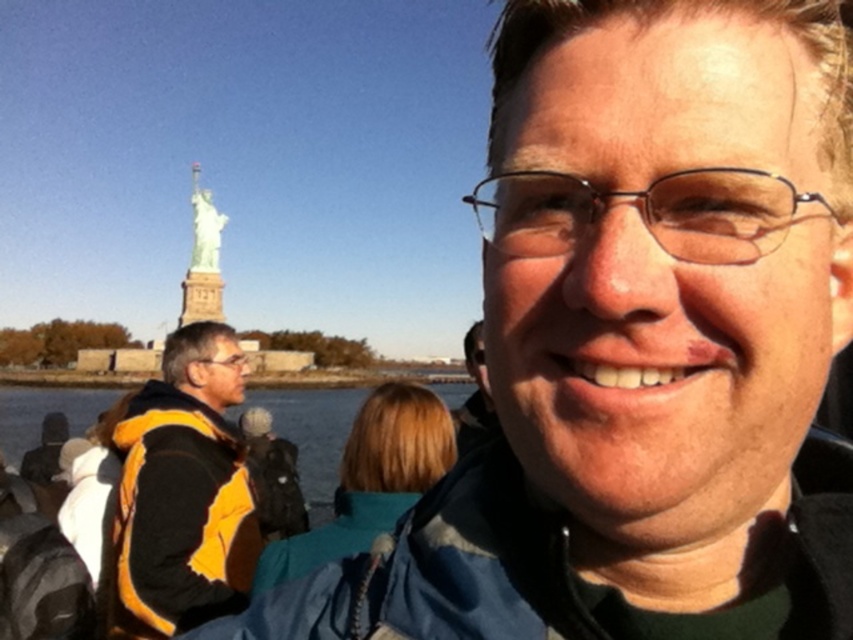
Which is in front, point (367, 438) or point (247, 401)?

Point (367, 438) is more forward.

Between point (427, 429) and point (96, 388), which one is positioned behind?

The point (96, 388) is more distant.

Locate an element on the screen. This screenshot has width=853, height=640. teal fabric jacket at center is located at coordinates (370, 481).

Is clear water at lower left above polished bronze statue at upper left?

No.

Does clear water at lower left have a greater height compared to polished bronze statue at upper left?

Incorrect, clear water at lower left's height is not larger of polished bronze statue at upper left's.

Image resolution: width=853 pixels, height=640 pixels. Identify the location of clear water at lower left. (311, 435).

Which is in front, point (167, 525) or point (338, 448)?

Positioned in front is point (167, 525).

What do you see at coordinates (183, 493) in the screenshot? I see `yellow/black jacket at left` at bounding box center [183, 493].

Where is `yellow/black jacket at left`? Image resolution: width=853 pixels, height=640 pixels. yellow/black jacket at left is located at coordinates (183, 493).